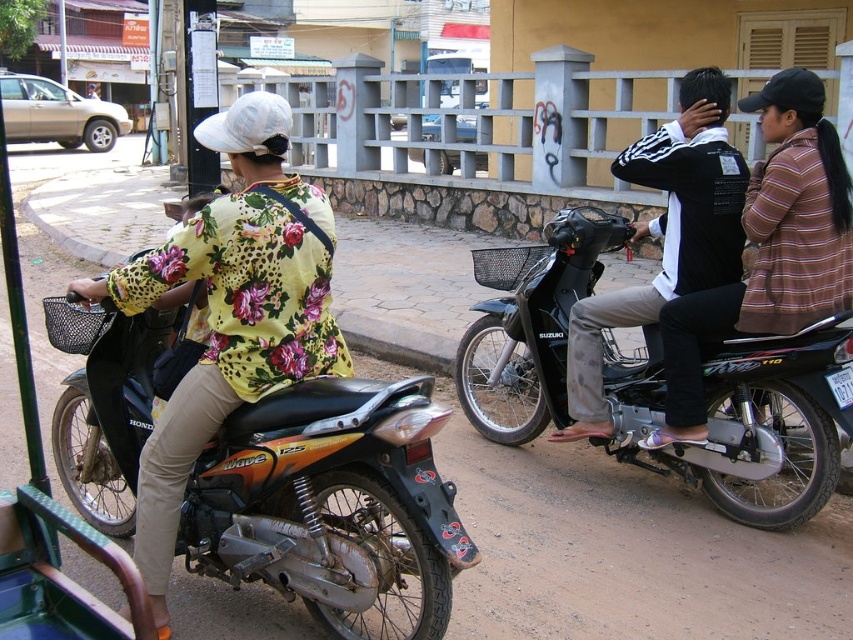
Is orange matte motorcycle at center thinner than black matte motorcycle at center?

No.

Is point (260, 547) farther from camera compared to point (805, 424)?

That is False.

The width and height of the screenshot is (853, 640). Find the location of `orange matte motorcycle at center`. orange matte motorcycle at center is located at coordinates (328, 504).

Can you confirm if black matte motorcycle at center is shorter than black matte jacket at center?

Yes, black matte motorcycle at center is shorter than black matte jacket at center.

Is black matte motorcycle at center above black matte jacket at center?

Incorrect, black matte motorcycle at center is not positioned above black matte jacket at center.

I want to click on black matte motorcycle at center, so click(746, 419).

Who is more forward, [166,385] or [579,417]?

Positioned in front is point [166,385].

Which is in front, point (115, 333) or point (729, 260)?

Point (115, 333) is more forward.

The width and height of the screenshot is (853, 640). In order to click on orange matte motorcycle at center in this screenshot , I will do `click(328, 504)`.